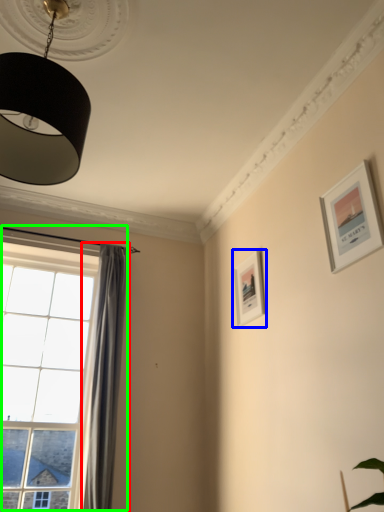
Question: Which is farther away from curtain (highlighted by a red box)? picture frame (highlighted by a blue box) or window (highlighted by a green box)?

Choices:
 (A) picture frame
 (B) window

Answer: (A)